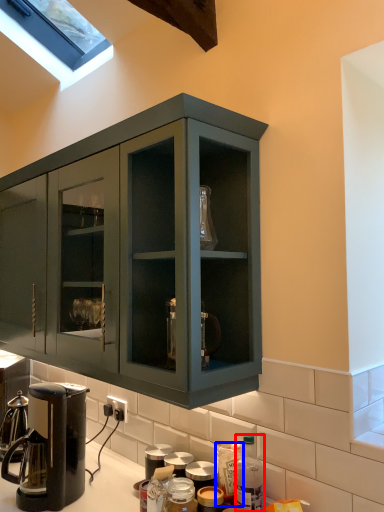
Question: Among these objects, which one is nearest to the camera, bottle (highlighted by a red box) or bottle (highlighted by a blue box)?

Choices:
 (A) bottle
 (B) bottle

Answer: (A)